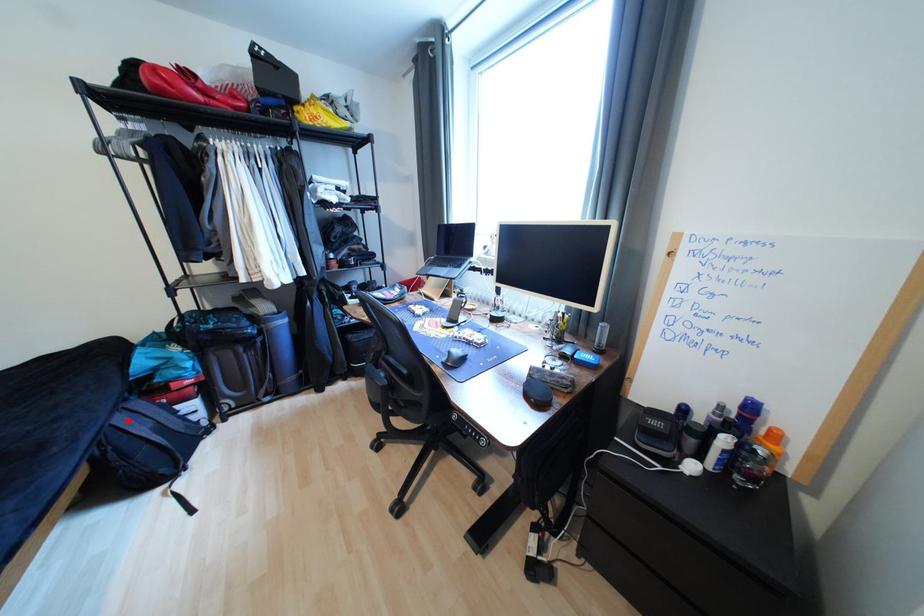
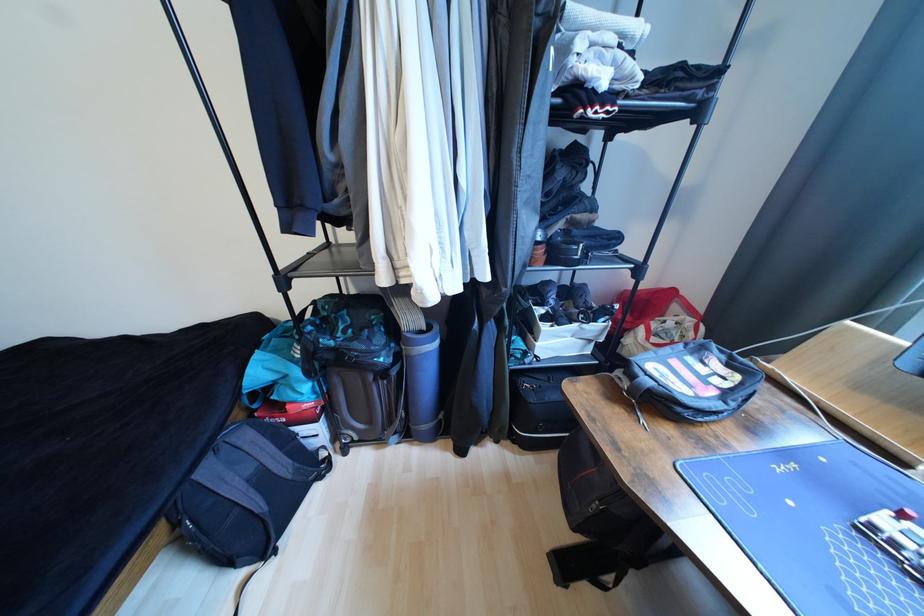
In the second image, find the point that corresponds to the highlighted location in the first image.

(215, 472)